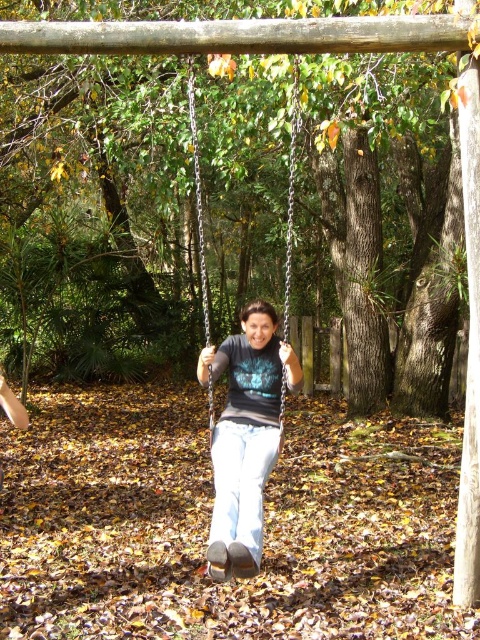
Does matte black shirt at center have a lesser height compared to metallic chain swing at center?

Indeed, matte black shirt at center has a lesser height compared to metallic chain swing at center.

You are a GUI agent. You are given a task and a screenshot of the screen. Output one action in this format:
    pyautogui.click(x=<x>, y=<y>)
    Task: Click on the matte black shirt at center
    This screenshot has width=480, height=640.
    Given the screenshot: What is the action you would take?
    pyautogui.click(x=244, y=435)